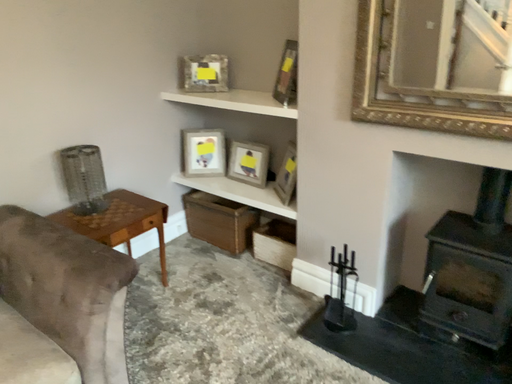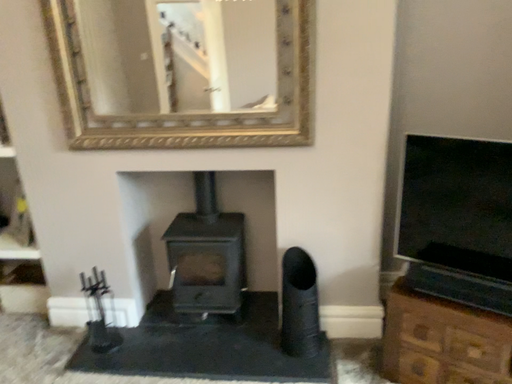
Question: How did the camera likely rotate when shooting the video?

Choices:
 (A) rotated downward
 (B) rotated upward

Answer: (B)